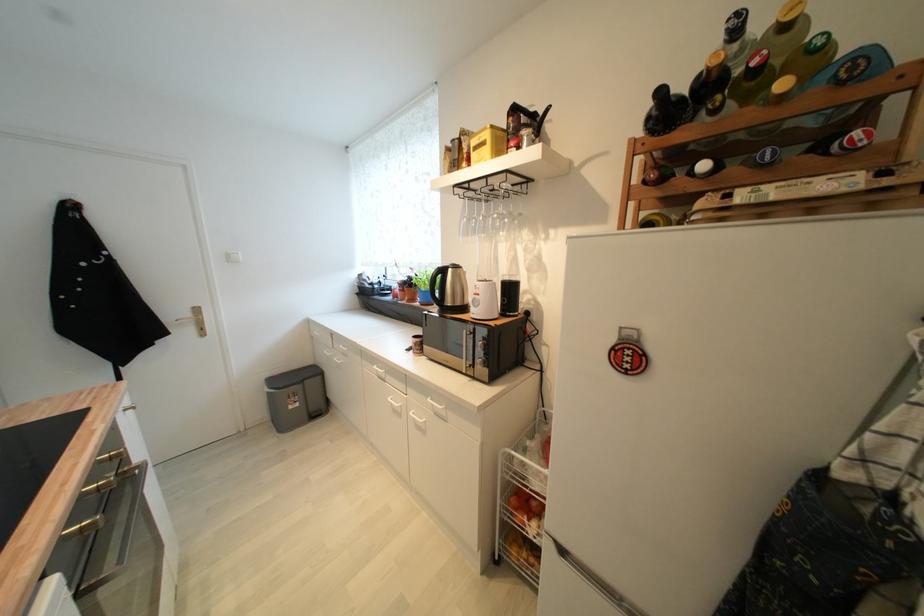
Locate an element on the screen. Image resolution: width=924 pixels, height=616 pixels. trash can pedal is located at coordinates click(290, 405).